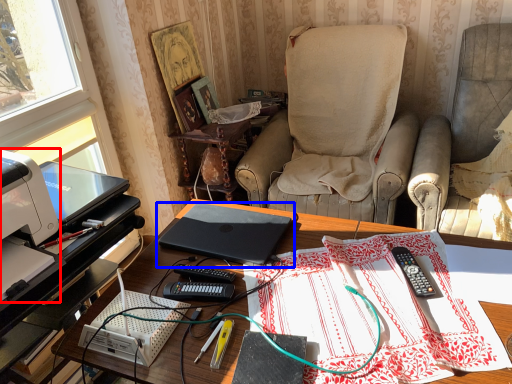
Question: Which of the following is the closest to the observer, printer (highlighted by a red box) or laptop (highlighted by a blue box)?

Choices:
 (A) printer
 (B) laptop

Answer: (A)